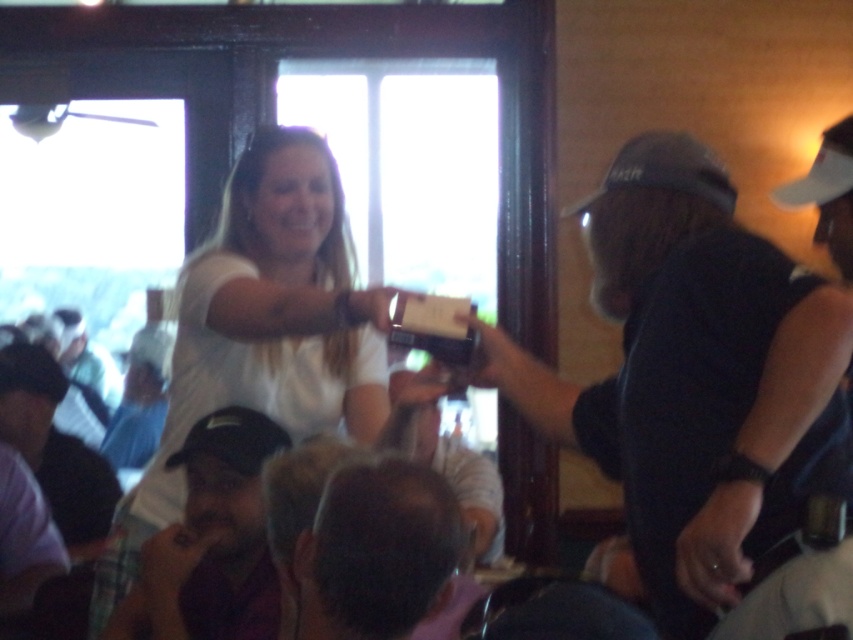
Question: Does white matte shirt at center have a larger size compared to white fabric baseball cap at upper right?

Choices:
 (A) no
 (B) yes

Answer: (B)

Question: Is dark brown leather cap at lower left in front of white fabric baseball cap at upper right?

Choices:
 (A) no
 (B) yes

Answer: (B)

Question: Among these objects, which one is nearest to the camera?

Choices:
 (A) dark brown leather cap at lower left
 (B) white fabric baseball cap at upper right

Answer: (A)

Question: Does black fabric baseball hat at upper right have a larger size compared to white fabric baseball cap at upper right?

Choices:
 (A) yes
 (B) no

Answer: (A)

Question: Among these points, which one is farthest from the camera?

Choices:
 (A) (831, 172)
 (B) (291, 522)
 (C) (210, 611)
 (D) (229, 330)

Answer: (A)

Question: Among these points, which one is nearest to the camera?

Choices:
 (A) (193, 600)
 (B) (368, 365)
 (C) (824, 168)

Answer: (A)